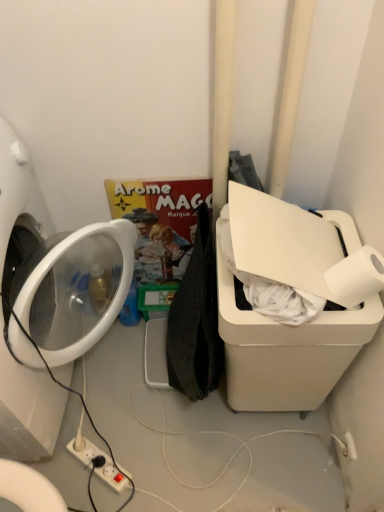
Question: Can you see white glossy washing machine at left touching white plastic water cooler at right?

Choices:
 (A) no
 (B) yes

Answer: (A)

Question: Considering the relative sizes of white glossy washing machine at left and white plastic water cooler at right in the image provided, is white glossy washing machine at left bigger than white plastic water cooler at right?

Choices:
 (A) no
 (B) yes

Answer: (B)

Question: Is white glossy washing machine at left wider than white plastic water cooler at right?

Choices:
 (A) yes
 (B) no

Answer: (A)

Question: Is white glossy washing machine at left closer to the viewer compared to white plastic water cooler at right?

Choices:
 (A) no
 (B) yes

Answer: (B)

Question: Does white glossy washing machine at left have a lesser width compared to white plastic water cooler at right?

Choices:
 (A) yes
 (B) no

Answer: (B)

Question: Is white plastic power strip at lower center inside or outside of matte cardboard comic book at center?

Choices:
 (A) outside
 (B) inside

Answer: (A)

Question: From the image's perspective, is white plastic power strip at lower center above or below matte cardboard comic book at center?

Choices:
 (A) above
 (B) below

Answer: (B)

Question: Considering the relative positions of white plastic power strip at lower center and matte cardboard comic book at center in the image provided, is white plastic power strip at lower center to the left or to the right of matte cardboard comic book at center?

Choices:
 (A) right
 (B) left

Answer: (B)

Question: From a real-world perspective, is white plastic power strip at lower center physically located above or below matte cardboard comic book at center?

Choices:
 (A) below
 (B) above

Answer: (A)

Question: In the image, is matte cardboard comic book at center on the left side or the right side of white matte toilet paper at upper right?

Choices:
 (A) left
 (B) right

Answer: (A)

Question: From the image's perspective, is matte cardboard comic book at center positioned above or below white matte toilet paper at upper right?

Choices:
 (A) above
 (B) below

Answer: (A)

Question: Is matte cardboard comic book at center situated inside white matte toilet paper at upper right or outside?

Choices:
 (A) outside
 (B) inside

Answer: (A)

Question: Considering their positions, is matte cardboard comic book at center located in front of or behind white matte toilet paper at upper right?

Choices:
 (A) front
 (B) behind

Answer: (B)

Question: Is white glossy washing machine at left to the left or to the right of white plastic power strip at lower center in the image?

Choices:
 (A) right
 (B) left

Answer: (B)

Question: From a real-world perspective, is white glossy washing machine at left above or below white plastic power strip at lower center?

Choices:
 (A) above
 (B) below

Answer: (A)